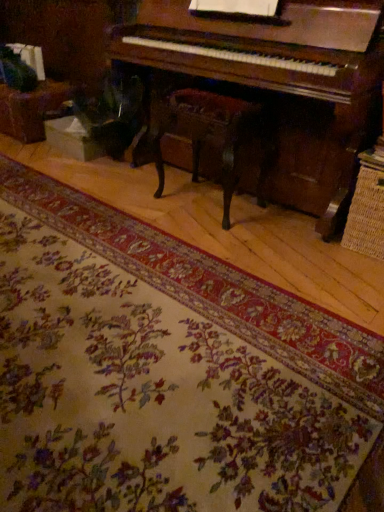
Measure the distance between wooden polished chair at center and camera.

A distance of 6.03 feet exists between wooden polished chair at center and camera.

What do you see at coordinates (209, 134) in the screenshot?
I see `wooden polished chair at center` at bounding box center [209, 134].

What are the coordinates of `wooden polished chair at center` in the screenshot? It's located at (209, 134).

What is the approximate height of floral carpet at center?

floral carpet at center is 2.54 inches in height.

This screenshot has width=384, height=512. Identify the location of floral carpet at center. (165, 371).

This screenshot has width=384, height=512. What do you see at coordinates (165, 371) in the screenshot?
I see `floral carpet at center` at bounding box center [165, 371].

Image resolution: width=384 pixels, height=512 pixels. In order to click on wooden polished chair at center in this screenshot , I will do (209, 134).

Can you confirm if wooden polished chair at center is positioned to the left of floral carpet at center?

No.

Relative to floral carpet at center, is wooden polished chair at center in front or behind?

wooden polished chair at center is positioned farther from the viewer than floral carpet at center.

Is point (230, 162) in front of point (53, 501)?

No.

From the image's perspective, relative to floral carpet at center, is wooden polished chair at center above or below?

Based on their image positions, wooden polished chair at center is located above floral carpet at center.

From a real-world perspective, who is located higher, wooden polished chair at center or floral carpet at center?

In real-world perspective, wooden polished chair at center is above.

Is wooden polished chair at center wider or thinner than floral carpet at center?

Clearly, wooden polished chair at center has less width compared to floral carpet at center.

Does wooden polished chair at center have a greater height compared to floral carpet at center?

Yes, wooden polished chair at center is taller than floral carpet at center.

Who is smaller, wooden polished chair at center or floral carpet at center?

wooden polished chair at center.

Choose the correct answer: Is wooden polished chair at center inside floral carpet at center or outside it?

wooden polished chair at center is not enclosed by floral carpet at center.

Would you consider wooden polished chair at center to be distant from floral carpet at center?

That's not correct — wooden polished chair at center is a little close to floral carpet at center.

Is wooden polished chair at center turned away from floral carpet at center?

No, wooden polished chair at center's orientation is not away from floral carpet at center.

Can you tell me how much wooden polished chair at center and floral carpet at center differ in facing direction?

wooden polished chair at center and floral carpet at center are facing 180 degrees away from each other.

What are the coordinates of `music stool above the floral carpet at center (from a real-world perspective)` in the screenshot? It's located at (209, 134).

Visually, is floral carpet at center positioned to the left or to the right of wooden polished chair at center?

In the image, floral carpet at center appears on the left side of wooden polished chair at center.

Does floral carpet at center lie behind wooden polished chair at center?

No, floral carpet at center is in front of wooden polished chair at center.

Does point (203, 493) lie behind point (223, 204)?

No, (203, 493) is in front of (223, 204).

From the image's perspective, which object appears higher, floral carpet at center or wooden polished chair at center?

wooden polished chair at center.

In the scene shown: From a real-world perspective, is floral carpet at center on wooden polished chair at center?

No, from a real-world perspective, floral carpet at center is not on top of wooden polished chair at center.

Which object is wider, floral carpet at center or wooden polished chair at center?

With larger width is floral carpet at center.

Is floral carpet at center taller or shorter than wooden polished chair at center?

Considering their sizes, floral carpet at center has less height than wooden polished chair at center.

Is floral carpet at center smaller than wooden polished chair at center?

No, floral carpet at center is not smaller than wooden polished chair at center.

Choose the correct answer: Is floral carpet at center inside wooden polished chair at center or outside it?

floral carpet at center is spatially situated outside wooden polished chair at center.

Can you see floral carpet at center touching wooden polished chair at center?

No, floral carpet at center is not touching wooden polished chair at center.

Is floral carpet at center oriented away from wooden polished chair at center?

That's not correct — floral carpet at center is not looking away from wooden polished chair at center.

Can you tell me how much floral carpet at center and wooden polished chair at center differ in facing direction?

180 degrees.

Where is `mat on the left side of wooden polished chair at center`? mat on the left side of wooden polished chair at center is located at coordinates (165, 371).

Find the location of a particular element. mat that is in front of the wooden polished chair at center is located at coordinates (165, 371).

In order to click on mat located on the left of wooden polished chair at center in this screenshot , I will do `click(165, 371)`.